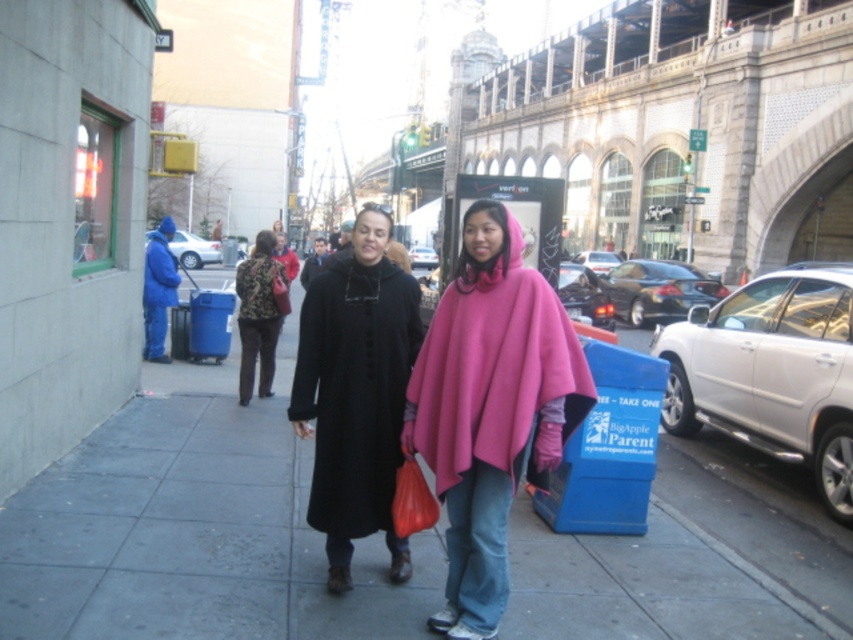
Who is positioned more to the left, smooth concrete sidewalk at center or floral fabric coat at center?

floral fabric coat at center

Can you confirm if smooth concrete sidewalk at center is positioned above floral fabric coat at center?

No, smooth concrete sidewalk at center is not above floral fabric coat at center.

Does point (409, 600) come behind point (242, 291)?

No, it is not.

In order to click on smooth concrete sidewalk at center in this screenshot , I will do `click(195, 528)`.

Does pink fleece poncho at center have a lesser height compared to floral fabric coat at center?

Incorrect, pink fleece poncho at center's height does not fall short of floral fabric coat at center's.

Image resolution: width=853 pixels, height=640 pixels. What are the coordinates of `pink fleece poncho at center` in the screenshot? It's located at (490, 406).

Locate an element on the screen. pink fleece poncho at center is located at coordinates (490, 406).

Is smooth concrete sidewalk at center closer to the viewer compared to pink fleece poncho at center?

Yes, smooth concrete sidewalk at center is in front of pink fleece poncho at center.

The width and height of the screenshot is (853, 640). In order to click on smooth concrete sidewalk at center in this screenshot , I will do `click(195, 528)`.